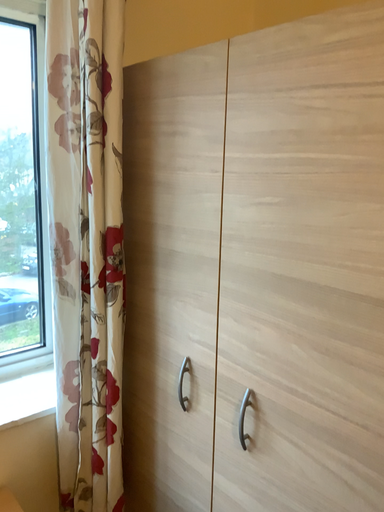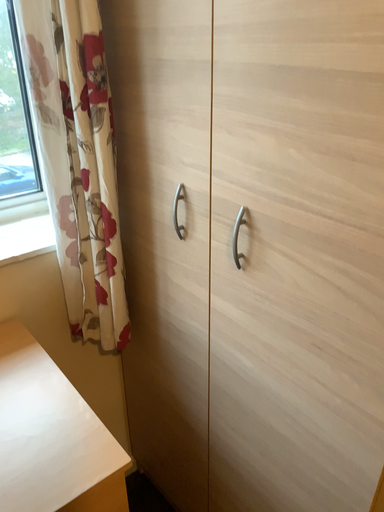
Question: Which way did the camera rotate in the video?

Choices:
 (A) rotated downward
 (B) rotated upward

Answer: (A)